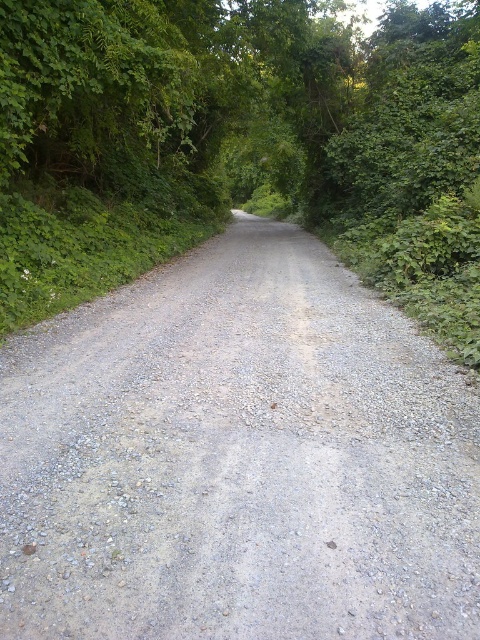
You are standing at the entrance of the road and want to reach the point marked as point (95,365). Can you estimate how far you need to walk to reach that point?

The distance between you and point (95,365) is 3.03 meters, so you need to walk approximately 3.03 meters to reach it.

You are standing at the start of the gray gravel road at center and want to walk towards the green leafy forest at center. Which direction should you go to reach the forest?

Since the gray gravel road at center is closer to the viewer than the green leafy forest at center, you should walk forward along the gray gravel road at center towards the direction where it narrows and the forest becomes denser to reach the green leafy forest at center.

You are driving a car with a width of 2 meters. You need to navigate through the gray gravel road at center and the green leafy forest at center. Can your car fit between them?

The gray gravel road at center is positioned on the left side of green leafy forest at center, meaning they are adjacent to each other. Since the road itself is narrow and the forest is on one side, the car can likely fit on the road as it is designed for vehicles, but there is no space between the road and the forest for the car to pass through sideways. Therefore, the car can proceed along the road but cannot fit between them sideways.